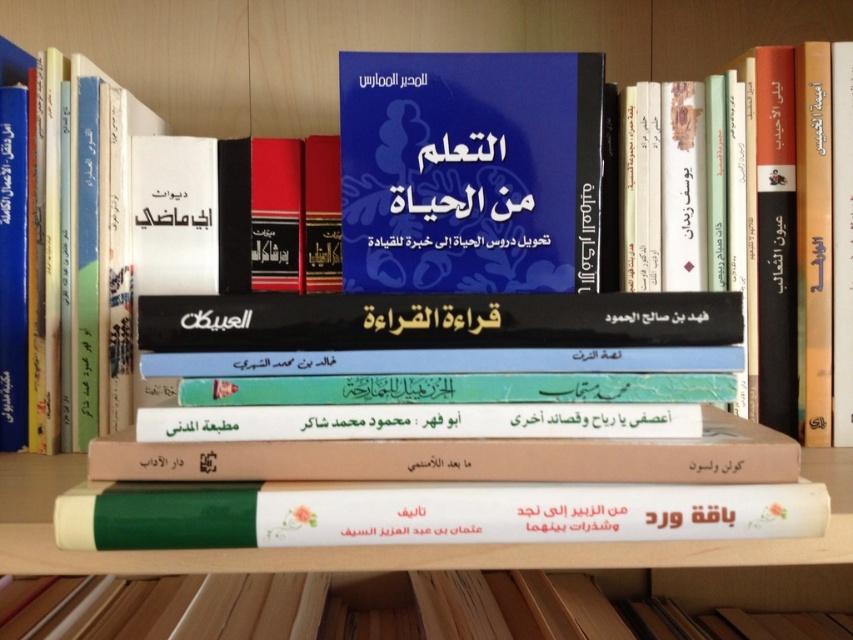
Question: Where is blue matte book at center located in relation to white paper book at center in the image?

Choices:
 (A) above
 (B) below

Answer: (A)

Question: Is green matte book at center thinner than white paper book at center?

Choices:
 (A) no
 (B) yes

Answer: (A)

Question: Is green matte book at center to the left of white paper book at center from the viewer's perspective?

Choices:
 (A) yes
 (B) no

Answer: (B)

Question: Among these objects, which one is nearest to the camera?

Choices:
 (A) green matte book at center
 (B) white paper book at center

Answer: (B)

Question: Which object appears farthest from the camera in this image?

Choices:
 (A) blue matte book at center
 (B) green matte book at center
 (C) white paper book at center

Answer: (B)

Question: Which object is closer to the camera taking this photo?

Choices:
 (A) blue matte book at center
 (B) white paper book at center
 (C) green matte book at center

Answer: (B)